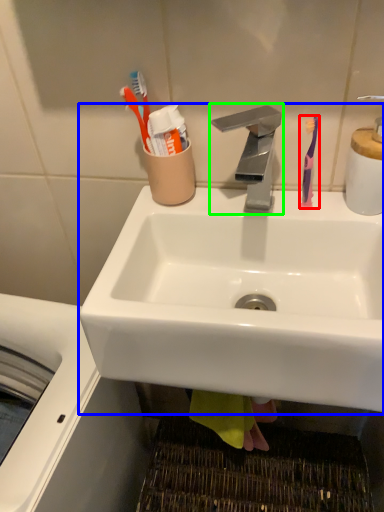
Question: Considering the real-world distances, which object is closest to toothbrush (highlighted by a red box)? sink (highlighted by a blue box) or tap (highlighted by a green box).

Choices:
 (A) sink
 (B) tap

Answer: (B)